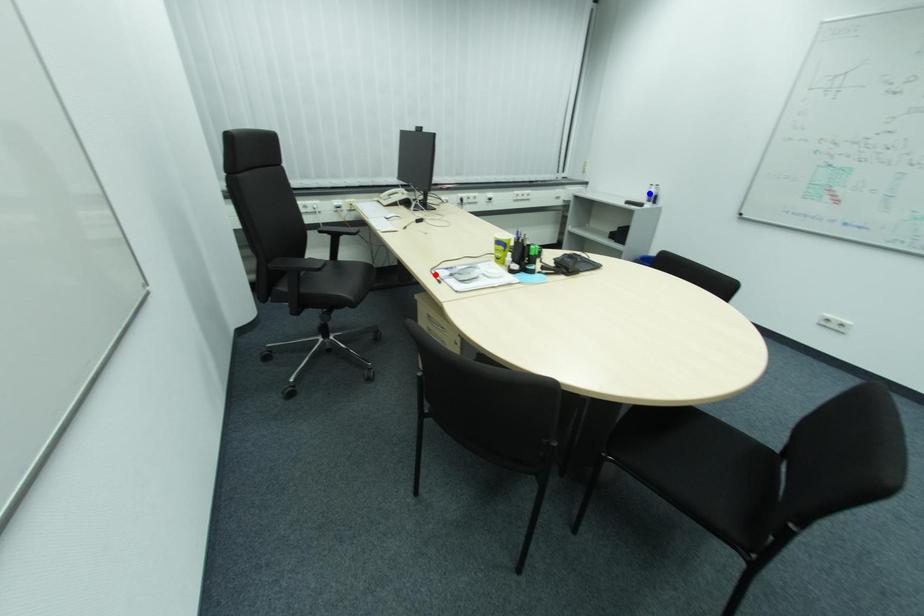
Question: Two points are marked on the image. Which point is closer to the camera?

Choices:
 (A) Blue point is closer.
 (B) Red point is closer.

Answer: (B)